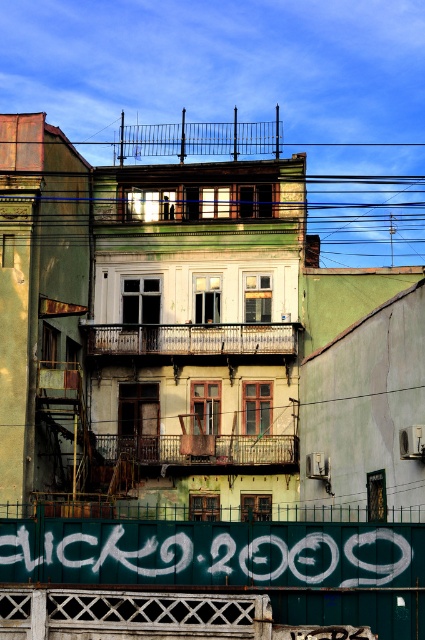
Question: Is white graffiti at center bigger than wooden railing at center?

Choices:
 (A) yes
 (B) no

Answer: (B)

Question: Is rustic wood balcony at center wider than wooden railing at center?

Choices:
 (A) no
 (B) yes

Answer: (B)

Question: Which of the following is the farthest from the observer?

Choices:
 (A) rustic wood balcony at center
 (B) wooden railing at center
 (C) white graffiti at center

Answer: (A)

Question: Estimate the real-world distances between objects in this image. Which object is farther from the rustic wood balcony at center?

Choices:
 (A) wooden railing at center
 (B) white graffiti at center

Answer: (B)

Question: Does white graffiti at center appear on the left side of rustic wood balcony at center?

Choices:
 (A) yes
 (B) no

Answer: (B)

Question: Which point is closer to the camera?

Choices:
 (A) wooden railing at center
 (B) rustic wood balcony at center

Answer: (A)